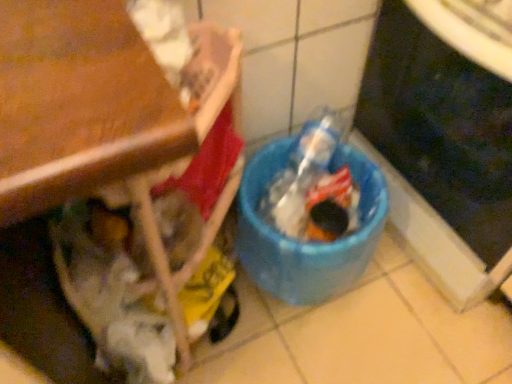
Identify the location of blue plastic trash can at lower right. (441, 127).

Measure the distance between blue plastic trash can at lower right and camera.

They are 82.10 centimeters apart.

The width and height of the screenshot is (512, 384). What do you see at coordinates (441, 127) in the screenshot?
I see `blue plastic trash can at lower right` at bounding box center [441, 127].

Image resolution: width=512 pixels, height=384 pixels. I want to click on blue plastic bucket at lower center, so click(x=307, y=242).

In order to face blue plastic bucket at lower center, should I rotate leftwards or rightwards?

To face it directly, rotate right by 8.089 degrees.

The height and width of the screenshot is (384, 512). What do you see at coordinates (307, 242) in the screenshot? I see `blue plastic bucket at lower center` at bounding box center [307, 242].

Where is `blue plastic trash can at lower right`? blue plastic trash can at lower right is located at coordinates (441, 127).

Can you confirm if blue plastic trash can at lower right is positioned to the right of blue plastic bucket at lower center?

Yes.

Which is behind, blue plastic trash can at lower right or blue plastic bucket at lower center?

blue plastic bucket at lower center is further from the camera.

Is point (501, 245) positioned before point (312, 295)?

That is True.

From the image's perspective, which is below, blue plastic trash can at lower right or blue plastic bucket at lower center?

blue plastic bucket at lower center.

From a real-world perspective, is blue plastic trash can at lower right beneath blue plastic bucket at lower center?

Actually, blue plastic trash can at lower right is physically above blue plastic bucket at lower center in the real world.

Which object is thinner, blue plastic trash can at lower right or blue plastic bucket at lower center?

With smaller width is blue plastic bucket at lower center.

Does blue plastic trash can at lower right have a greater height compared to blue plastic bucket at lower center?

Yes, blue plastic trash can at lower right is taller than blue plastic bucket at lower center.

Is blue plastic trash can at lower right smaller than blue plastic bucket at lower center?

No.

Is blue plastic trash can at lower right spatially inside blue plastic bucket at lower center, or outside of it?

blue plastic trash can at lower right is located beyond the bounds of blue plastic bucket at lower center.

Is blue plastic trash can at lower right directly adjacent to blue plastic bucket at lower center?

No, blue plastic trash can at lower right is not beside blue plastic bucket at lower center.

Is blue plastic trash can at lower right oriented towards blue plastic bucket at lower center?

Yes, blue plastic trash can at lower right faces towards blue plastic bucket at lower center.

Identify the location of appliance in front of the blue plastic bucket at lower center. The height and width of the screenshot is (384, 512). (441, 127).

In the scene shown: In the image, is blue plastic bucket at lower center on the left side or the right side of blue plastic trash can at lower right?

Based on their positions, blue plastic bucket at lower center is located to the left of blue plastic trash can at lower right.

Which object is further away from the camera, blue plastic bucket at lower center or blue plastic trash can at lower right?

blue plastic bucket at lower center is more distant.

Considering the points (327, 282) and (476, 179), which point is in front, point (327, 282) or point (476, 179)?

Point (476, 179)

From the image's perspective, is blue plastic bucket at lower center located beneath blue plastic trash can at lower right?

Correct, blue plastic bucket at lower center appears lower than blue plastic trash can at lower right in the image.

From a real-world perspective, which object rests below the other?

blue plastic bucket at lower center is physically lower.

Looking at their sizes, would you say blue plastic bucket at lower center is wider or thinner than blue plastic trash can at lower right?

blue plastic bucket at lower center is thinner than blue plastic trash can at lower right.

Who is taller, blue plastic bucket at lower center or blue plastic trash can at lower right?

blue plastic trash can at lower right is taller.

Who is bigger, blue plastic bucket at lower center or blue plastic trash can at lower right?

With larger size is blue plastic trash can at lower right.

Is blue plastic bucket at lower center surrounding blue plastic trash can at lower right?

No, blue plastic trash can at lower right is located outside of blue plastic bucket at lower center.

Is blue plastic bucket at lower center far from blue plastic trash can at lower right?

blue plastic bucket at lower center is actually quite close to blue plastic trash can at lower right.

Is blue plastic trash can at lower right at the back of blue plastic bucket at lower center?

No, blue plastic bucket at lower center is not facing away from blue plastic trash can at lower right.

Locate an element on the screen. The image size is (512, 384). appliance in front of the blue plastic bucket at lower center is located at coordinates (441, 127).

Where is `recycling bin behind the blue plastic trash can at lower right`? This screenshot has width=512, height=384. recycling bin behind the blue plastic trash can at lower right is located at coordinates (307, 242).

Where is `appliance on the right of blue plastic bucket at lower center`? Image resolution: width=512 pixels, height=384 pixels. appliance on the right of blue plastic bucket at lower center is located at coordinates (441, 127).